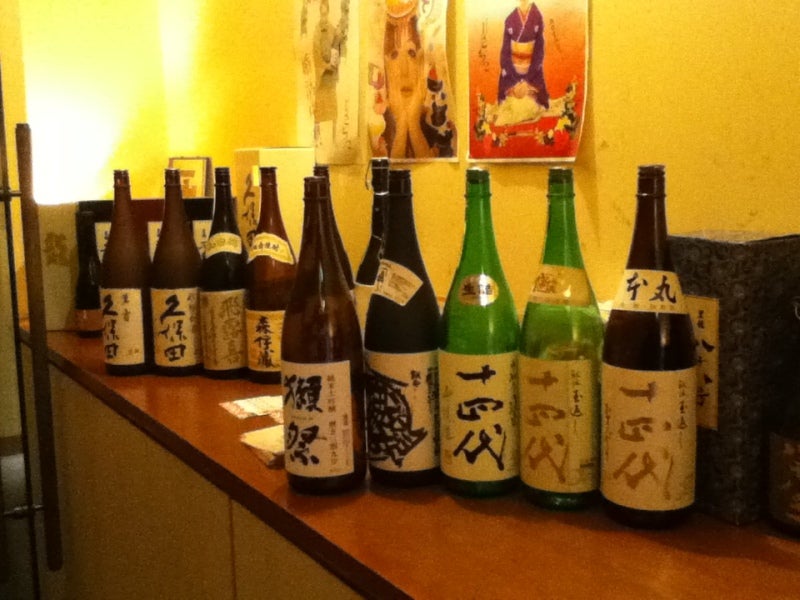
What are the coordinates of `wall` in the screenshot? It's located at (630, 95), (160, 89).